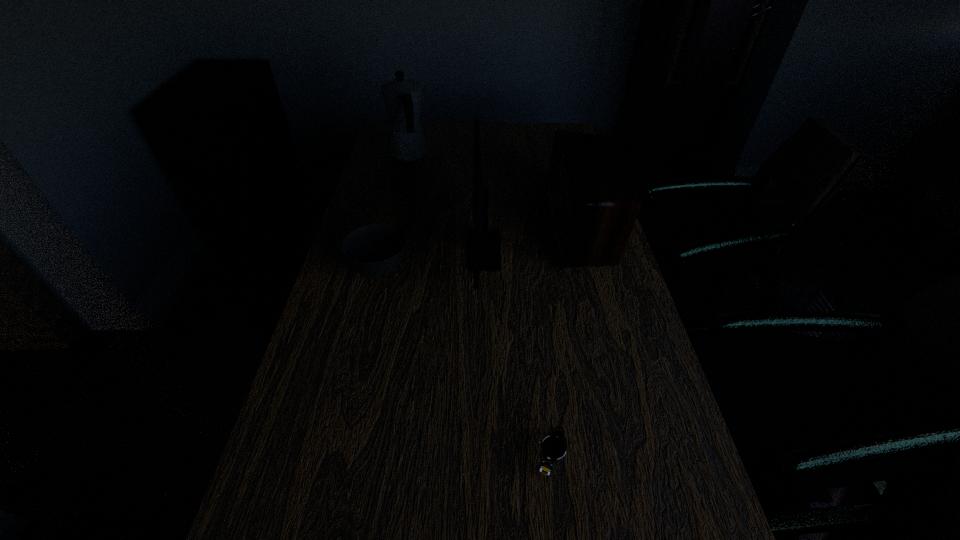
Locate an element on the screen. The width and height of the screenshot is (960, 540). object that is positioned at the far left corner is located at coordinates (402, 98).

At what (x,y) coordinates should I click in order to perform the action: click on free space at the far edge of the desktop. Please return your answer as a coordinate pair (x, y). This screenshot has width=960, height=540. Looking at the image, I should click on (481, 138).

This screenshot has height=540, width=960. I want to click on vacant region at the left edge of the desktop, so click(396, 213).

The image size is (960, 540). What are the coordinates of `free space at the right edge of the desktop` in the screenshot? It's located at (614, 523).

In order to click on vacant space at the far left corner in this screenshot , I will do `click(388, 131)`.

Find the location of `vacant space at the far right corner of the desktop`. vacant space at the far right corner of the desktop is located at coordinates (551, 131).

The width and height of the screenshot is (960, 540). What are the coordinates of `free point between the computer monitor and the rightmost object` in the screenshot? It's located at (533, 239).

At what (x,y) coordinates should I click in order to perform the action: click on free space between the watch and the radio receiver. Please return your answer as a coordinate pair (x, y). The height and width of the screenshot is (540, 960). Looking at the image, I should click on (565, 341).

Where is `vacant space in between the computer monitor and the coffeepot`? This screenshot has width=960, height=540. vacant space in between the computer monitor and the coffeepot is located at coordinates (446, 202).

Where is `free space between the fourth tallest object and the coffeepot`? This screenshot has width=960, height=540. free space between the fourth tallest object and the coffeepot is located at coordinates (394, 212).